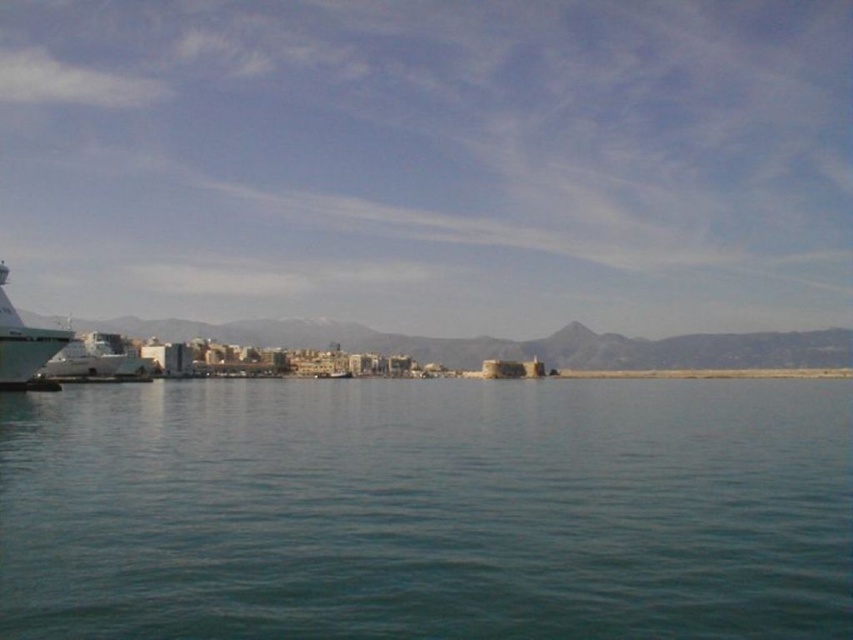
Question: Which of the following is the farthest from the observer?

Choices:
 (A) (759, 381)
 (B) (12, 368)

Answer: (A)

Question: Is clear blue water at center bigger than white glossy boat at left?

Choices:
 (A) no
 (B) yes

Answer: (B)

Question: Is clear blue water at center wider than white glossy boat at left?

Choices:
 (A) yes
 (B) no

Answer: (A)

Question: Which of the following is the farthest from the observer?

Choices:
 (A) white glossy boat at left
 (B) clear blue water at center

Answer: (A)

Question: Which point is closer to the camera?

Choices:
 (A) (18, 592)
 (B) (56, 346)

Answer: (A)

Question: Can you confirm if clear blue water at center is bigger than white glossy boat at left?

Choices:
 (A) no
 (B) yes

Answer: (B)